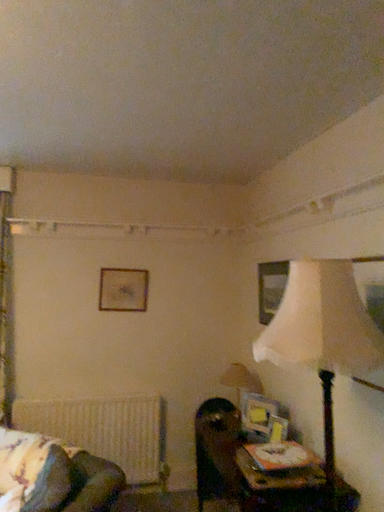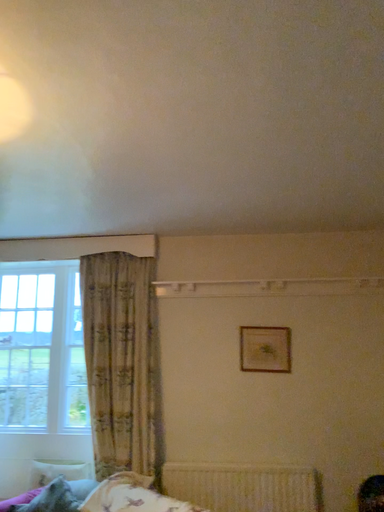
Question: Which way did the camera rotate in the video?

Choices:
 (A) rotated left
 (B) rotated right

Answer: (A)